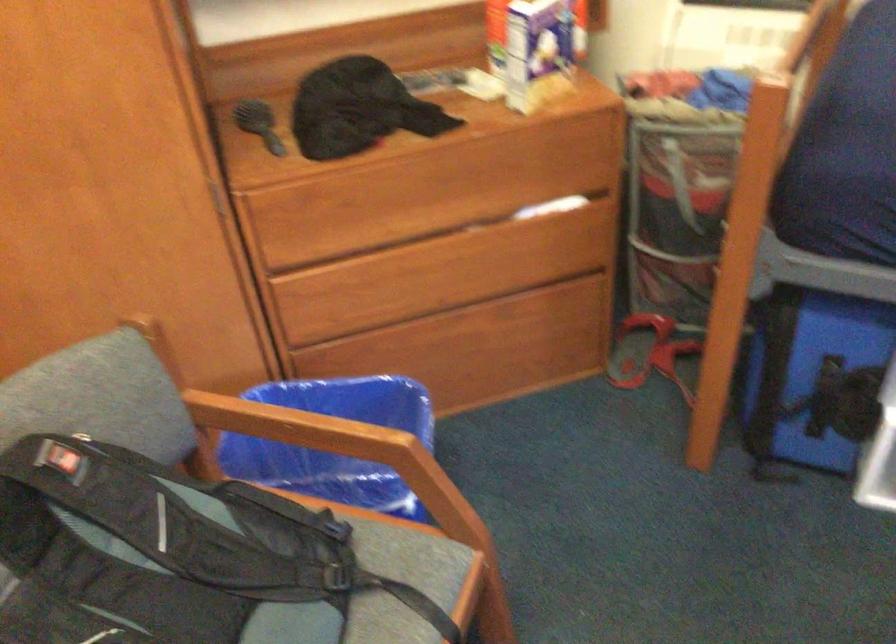
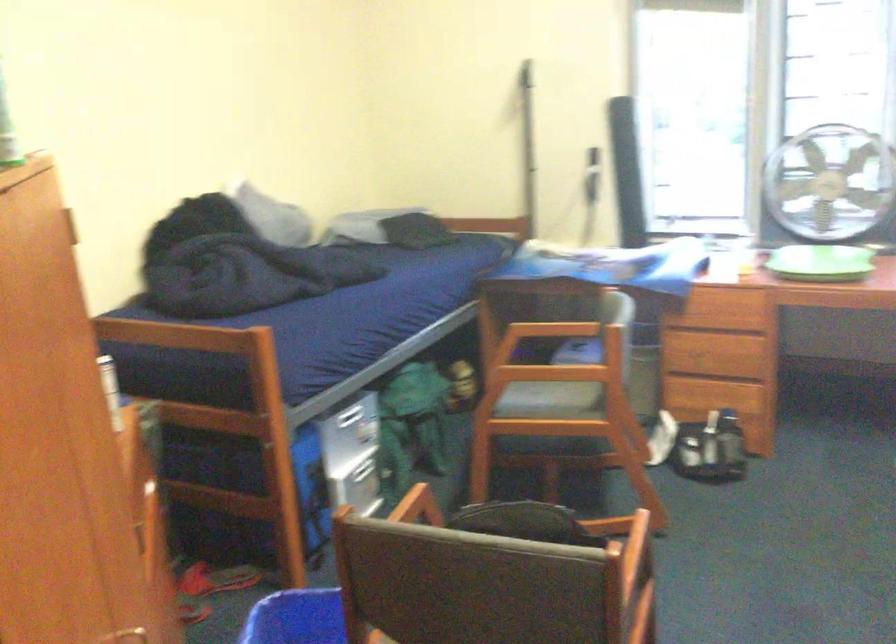
Question: I am providing you with two images of the same scene from different viewpoints. Please identify which objects are invisible in image2.

Choices:
 (A) grey stuffed shark
 (B) green circular tray
 (C) blue plastic bin
 (D) wooden chair armrest

Answer: (C)